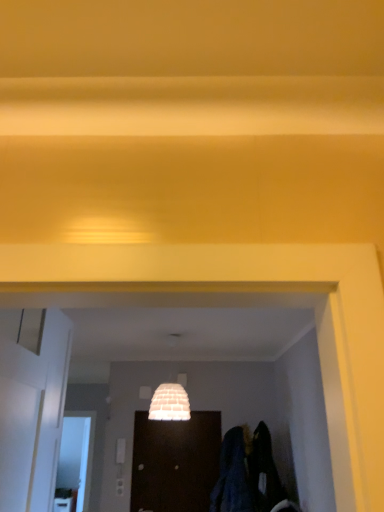
Question: Is white glossy door at left, placed as the 1th door when sorted from top to bottom, to the left of dark blue fabric at lower right from the viewer's perspective?

Choices:
 (A) yes
 (B) no

Answer: (A)

Question: Can you confirm if white glossy door at left, the 1th door when ordered from front to back, is taller than dark blue fabric at lower right?

Choices:
 (A) no
 (B) yes

Answer: (B)

Question: Is the depth of white glossy door at left, placed as the 1th door when sorted from top to bottom, greater than that of dark blue fabric at lower right?

Choices:
 (A) no
 (B) yes

Answer: (A)

Question: From the image's perspective, is white glossy door at left, which ranks as the second door in back-to-front order, located beneath dark blue fabric at lower right?

Choices:
 (A) yes
 (B) no

Answer: (B)

Question: Is white glossy door at left, the 1th door when ordered from front to back, oriented towards dark blue fabric at lower right?

Choices:
 (A) yes
 (B) no

Answer: (B)

Question: Is there a large distance between white glossy door at left, the second door when ordered from right to left, and dark blue fabric at lower right?

Choices:
 (A) yes
 (B) no

Answer: (A)

Question: Considering the relative sizes of white glossy door at left, acting as the 2th door starting from the bottom, and dark wood door at center, the 2th door in the top-to-bottom sequence, in the image provided, is white glossy door at left, acting as the 2th door starting from the bottom, shorter than dark wood door at center, the 2th door in the top-to-bottom sequence,?

Choices:
 (A) no
 (B) yes

Answer: (A)

Question: From the image's perspective, would you say white glossy door at left, which ranks as the second door in back-to-front order, is shown under dark wood door at center, marked as the 2th door in a left-to-right arrangement?

Choices:
 (A) no
 (B) yes

Answer: (A)

Question: Are white glossy door at left, the second door when ordered from right to left, and dark wood door at center, acting as the second door starting from the front, making contact?

Choices:
 (A) no
 (B) yes

Answer: (A)

Question: From the image's perspective, would you say white glossy door at left, which ranks as the second door in back-to-front order, is positioned over dark wood door at center, the first door from the back?

Choices:
 (A) yes
 (B) no

Answer: (A)

Question: Could you tell me if white glossy door at left, placed as the 1th door when sorted from top to bottom, is facing dark wood door at center, marked as the 2th door in a left-to-right arrangement?

Choices:
 (A) no
 (B) yes

Answer: (A)

Question: Is white glossy door at left, the second door when ordered from right to left, wider than dark wood door at center, the 2th door in the top-to-bottom sequence?

Choices:
 (A) yes
 (B) no

Answer: (A)

Question: From a real-world perspective, is dark blue fabric at lower right beneath white glossy door at left, acting as the 2th door starting from the bottom?

Choices:
 (A) yes
 (B) no

Answer: (A)